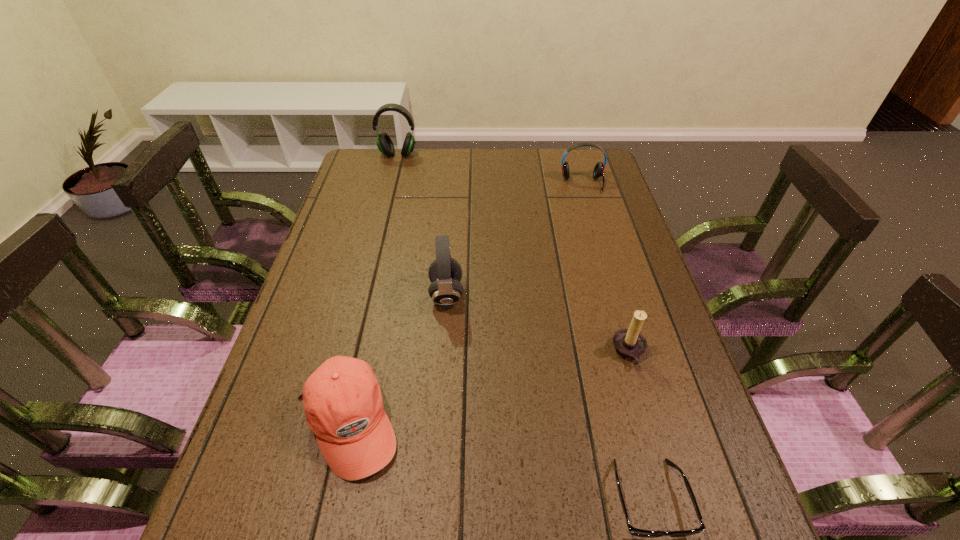
At what (x,y) coordinates should I click in order to perform the action: click on vacant space positioned with the microphone attached to the side of the shortest headset. Please return your answer as a coordinate pair (x, y). The image size is (960, 540). Looking at the image, I should click on (605, 262).

Where is `vacant space located on the wick of the candle holder`? This screenshot has height=540, width=960. vacant space located on the wick of the candle holder is located at coordinates (483, 352).

The height and width of the screenshot is (540, 960). Find the location of `vacant space situated 0.070m on the wick of the candle holder`. vacant space situated 0.070m on the wick of the candle holder is located at coordinates (582, 352).

Locate an element on the screen. free region located 0.300m on the wick of the candle holder is located at coordinates (483, 352).

Locate an element on the screen. free spot located 0.230m on the right of the baseball cap is located at coordinates (514, 423).

Find the location of a particular element. The width and height of the screenshot is (960, 540). headset present at the left edge is located at coordinates (385, 145).

Locate an element on the screen. This screenshot has width=960, height=540. baseball cap located in the left edge section of the desktop is located at coordinates (342, 399).

Locate an element on the screen. This screenshot has height=540, width=960. headset present at the right edge is located at coordinates (598, 171).

Find the location of a particular element. The width and height of the screenshot is (960, 540). candle holder present at the right edge is located at coordinates (629, 343).

Identify the location of object that is at the far left corner. The width and height of the screenshot is (960, 540). (385, 145).